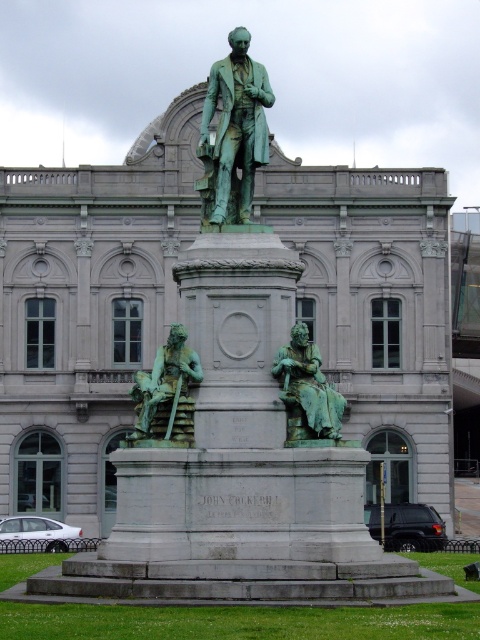
Question: Which point is farther to the camera?

Choices:
 (A) green patinated bronze statue at lower left
 (B) green patina bronze statue at center
 (C) green patina statue at center

Answer: (B)

Question: Is green patina bronze statue at center smaller than green patinated bronze statue at lower left?

Choices:
 (A) no
 (B) yes

Answer: (A)

Question: Is green patinated bronze statue at lower left behind green patina statue at center?

Choices:
 (A) no
 (B) yes

Answer: (A)

Question: Which of the following is the farthest from the observer?

Choices:
 (A) (243, 44)
 (B) (168, 406)
 (C) (316, 413)

Answer: (A)

Question: Estimate the real-world distances between objects in this image. Which object is closer to the green patinated bronze statue at lower left?

Choices:
 (A) green patina statue at center
 (B) green patina bronze statue at center

Answer: (A)

Question: Can you confirm if green patinated bronze statue at lower left is wider than green patina statue at center?

Choices:
 (A) no
 (B) yes

Answer: (B)